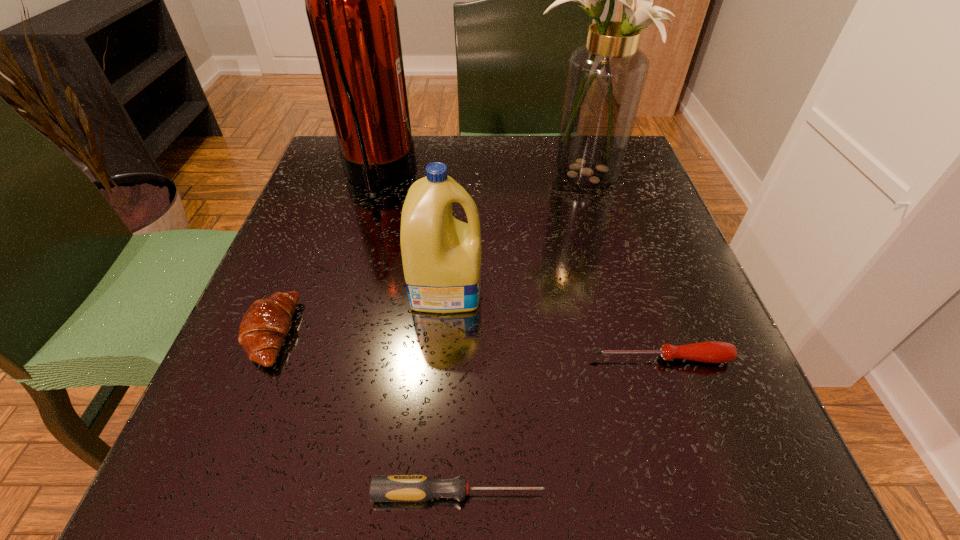
At what (x,y) coordinates should I click in order to perform the action: click on free space that satisfies the following two spatial constraints: 1. on the front side of the flower arrangement; 2. on the front-facing side of the fire extinguisher. Please return your answer as a coordinate pair (x, y). The width and height of the screenshot is (960, 540). Looking at the image, I should click on (582, 177).

Find the location of a particular element. free spot that satisfies the following two spatial constraints: 1. on the label of the detergent; 2. on the back side of the farther screwdriver is located at coordinates (441, 359).